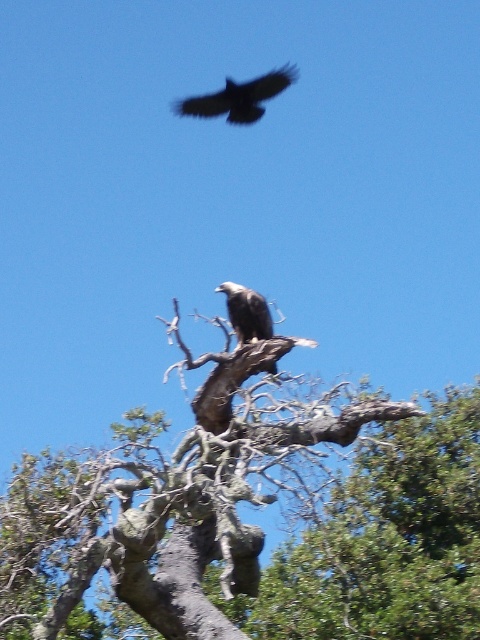
You are a photographer trying to capture the dark brown eagle at upper center. However, the gray bark tree trunk at center is blocking part of the eagle in your shot. Can you adjust your position to get a clear view of the eagle without the trunk blocking it?

The gray bark tree trunk at center is in front of the dark brown eagle at upper center, so moving your position to the left or right might allow you to see around the trunk and get a clear view of the eagle.

You are a birdwatcher observing the gray bark tree trunk at center and the dark brown eagle at upper center. Which object is positioned higher in the image?

The dark brown eagle at upper center is positioned higher than the gray bark tree trunk at center.

In the image, you see a dark brown eagle at upper center and dark brown feathers at center. Which object is positioned more to the left?

The dark brown eagle at upper center is positioned more to the left than the dark brown feathers at center.